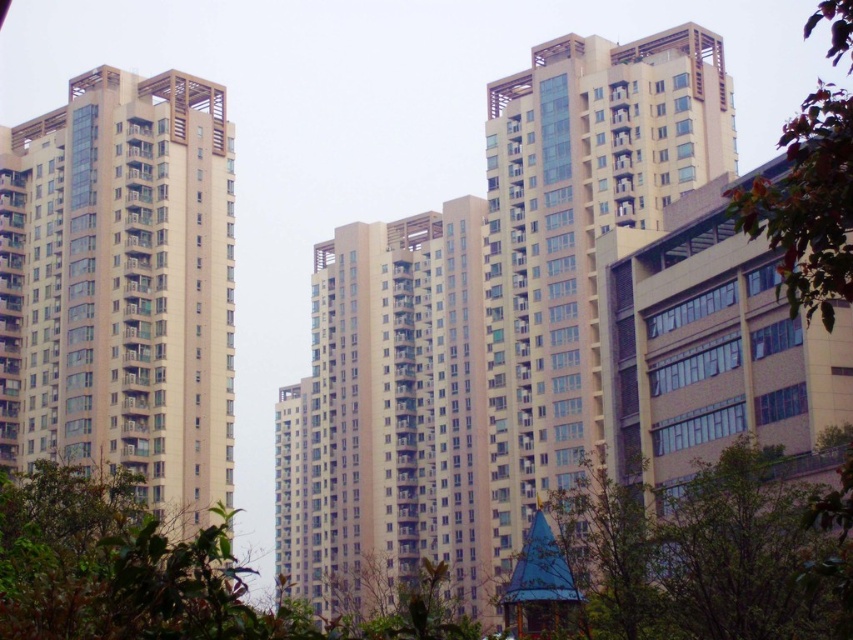
You are a drone operator who needs to fly a drone from the beige smooth building at left to the green leafy tree at right. Given that your drone has a maximum flight range of 50 meters, can it make the trip without needing to recharge?

The distance between the beige smooth building at left and the green leafy tree at right is 60.25 meters. Since the drone can only fly 50 meters before needing to recharge, it cannot complete the trip without recharging.

You are standing in front of the beige smooth building at left and the green leafy tree at right. Which object is closer to you?

The beige smooth building at left is closer to you because it is positioned under the green leafy tree at right, indicating it is in front of the tree.